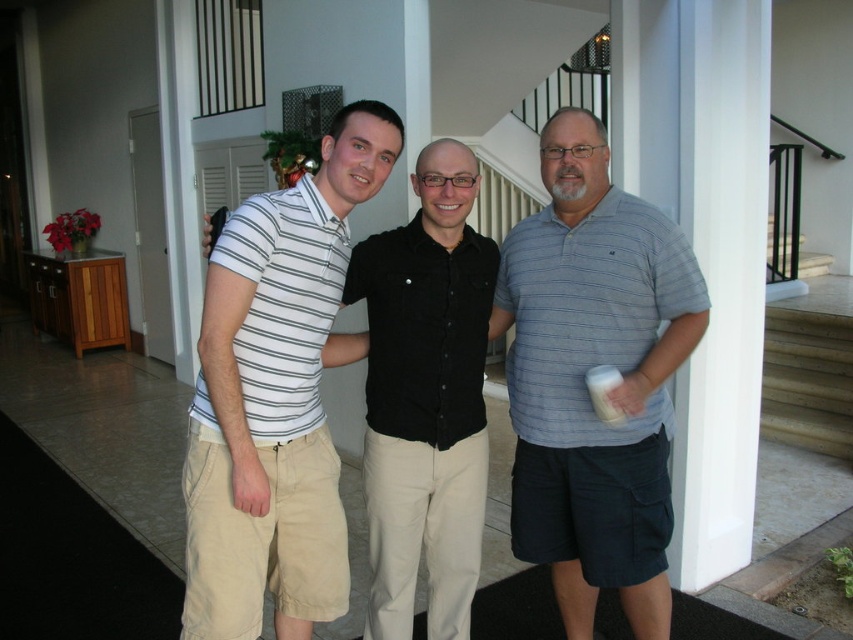
Question: Which point appears farthest from the camera in this image?

Choices:
 (A) (370, 157)
 (B) (434, 561)

Answer: (B)

Question: Is blue striped polo shirt at center to the left of white striped polo shirt at center from the viewer's perspective?

Choices:
 (A) yes
 (B) no

Answer: (B)

Question: Which object is positioned farthest from the black cotton shirt at center?

Choices:
 (A) blue striped polo shirt at center
 (B) white striped polo shirt at center

Answer: (A)

Question: Observing the image, what is the correct spatial positioning of blue striped polo shirt at center in reference to black cotton shirt at center?

Choices:
 (A) above
 (B) below

Answer: (A)

Question: Estimate the real-world distances between objects in this image. Which object is closer to the black cotton shirt at center?

Choices:
 (A) blue striped polo shirt at center
 (B) white striped polo shirt at center

Answer: (B)

Question: Where is white striped polo shirt at center located in relation to black cotton shirt at center in the image?

Choices:
 (A) above
 (B) below

Answer: (A)